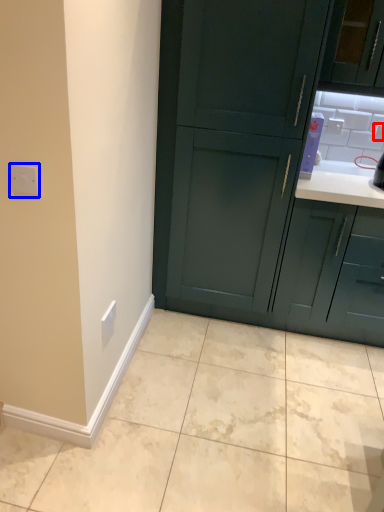
Question: Among these objects, which one is farthest to the camera, electric outlet (highlighted by a red box) or electric outlet (highlighted by a blue box)?

Choices:
 (A) electric outlet
 (B) electric outlet

Answer: (A)